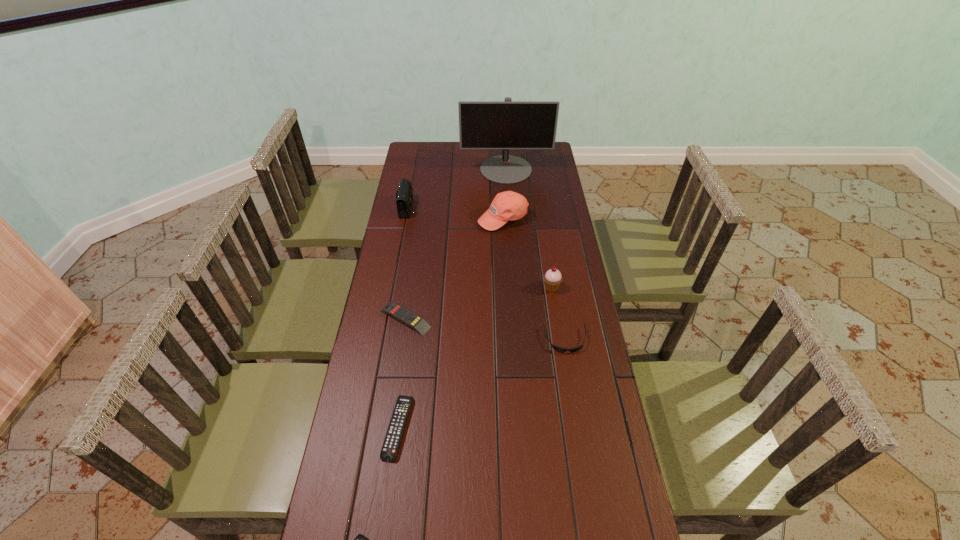
Where is `vacant region between the farthest remote control and the sunglasses`? This screenshot has width=960, height=540. vacant region between the farthest remote control and the sunglasses is located at coordinates (485, 329).

The width and height of the screenshot is (960, 540). Identify the location of vacant area that lies between the baseball cap and the clutch bag. (x=456, y=213).

You are a GUI agent. You are given a task and a screenshot of the screen. Output one action in this format:
    pyautogui.click(x=<x>, y=<y>)
    Task: Click on the empty space between the farthest remote control and the baseball cap
    Image resolution: width=960 pixels, height=540 pixels.
    Given the screenshot: What is the action you would take?
    pyautogui.click(x=454, y=268)

This screenshot has width=960, height=540. Find the location of `vacant area that lies between the farther black remote control and the yellow remote control`. vacant area that lies between the farther black remote control and the yellow remote control is located at coordinates click(401, 373).

Where is `object identified as the third closest to the farthest remote control`? object identified as the third closest to the farthest remote control is located at coordinates (552, 278).

Where is `the seventh closest object relative to the second nearest remote control`? This screenshot has width=960, height=540. the seventh closest object relative to the second nearest remote control is located at coordinates (507, 124).

Find the location of a particular element. remote control that stands as the second closest to the farthest object is located at coordinates (393, 437).

Locate an element on the screen. remote control that stands as the second closest to the farthest remote control is located at coordinates (360, 539).

Identify the location of free space that satisfies the following two spatial constraints: 1. on the front flap of the cupcake; 2. on the left side of the clutch bag. (395, 287).

Locate an element on the screen. This screenshot has height=540, width=960. free region that satisfies the following two spatial constraints: 1. on the front flap of the clutch bag; 2. on the right side of the cupcake is located at coordinates (395, 287).